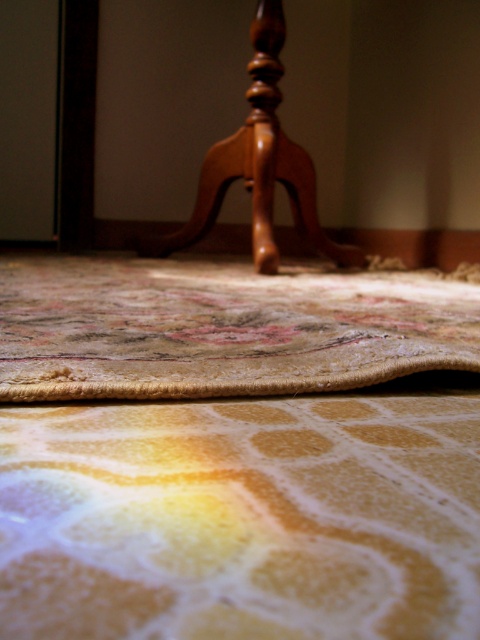
Who is taller, carpeted floor at center or polished wood chair at upper center?

Standing taller between the two is polished wood chair at upper center.

How distant is carpeted floor at center from polished wood chair at upper center?

carpeted floor at center is 22.42 inches from polished wood chair at upper center.

You are a GUI agent. You are given a task and a screenshot of the screen. Output one action in this format:
    pyautogui.click(x=<x>, y=<y>)
    Task: Click on the carpeted floor at center
    Image resolution: width=480 pixels, height=640 pixels.
    Given the screenshot: What is the action you would take?
    pyautogui.click(x=220, y=326)